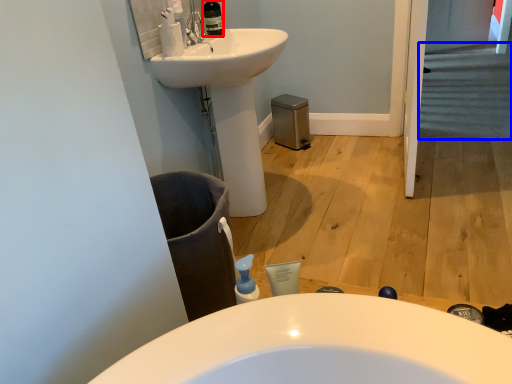
Question: Among these objects, which one is nearest to the camera, toiletry (highlighted by a red box) or stairs (highlighted by a blue box)?

Choices:
 (A) toiletry
 (B) stairs

Answer: (A)